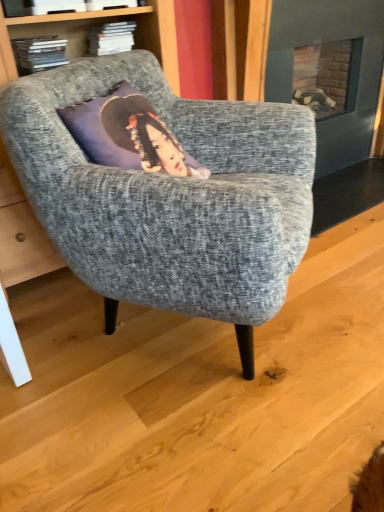
The height and width of the screenshot is (512, 384). What do you see at coordinates (39, 53) in the screenshot?
I see `hardcover book at upper left` at bounding box center [39, 53].

The image size is (384, 512). What are the coordinates of `hardcover book at upper left` in the screenshot? It's located at (39, 53).

What do you see at coordinates (169, 194) in the screenshot? I see `textured gray armchair at center` at bounding box center [169, 194].

Identify the location of textured gray armchair at center. The width and height of the screenshot is (384, 512). coord(169,194).

Where is `hardcover book at upper left`? This screenshot has width=384, height=512. hardcover book at upper left is located at coordinates (39, 53).

In the scene shown: Which object is positioned more to the left, hardcover book at upper left or textured gray armchair at center?

From the viewer's perspective, hardcover book at upper left appears more on the left side.

Considering the relative positions of hardcover book at upper left and textured gray armchair at center in the image provided, is hardcover book at upper left behind textured gray armchair at center?

Yes, the depth of hardcover book at upper left is greater than that of textured gray armchair at center.

Considering the points (28, 70) and (69, 221), which point is behind, point (28, 70) or point (69, 221)?

The point (28, 70) is farther.

From the image's perspective, which one is positioned higher, hardcover book at upper left or textured gray armchair at center?

From the image's view, hardcover book at upper left is above.

From a real-world perspective, between hardcover book at upper left and textured gray armchair at center, who is vertically higher?

hardcover book at upper left is physically above.

Between hardcover book at upper left and textured gray armchair at center, which one has smaller width?

With smaller width is hardcover book at upper left.

Can you confirm if hardcover book at upper left is shorter than textured gray armchair at center?

Indeed, hardcover book at upper left has a lesser height compared to textured gray armchair at center.

Between hardcover book at upper left and textured gray armchair at center, which one has smaller size?

hardcover book at upper left.

Is hardcover book at upper left completely or partially outside of textured gray armchair at center?

hardcover book at upper left lies outside textured gray armchair at center's area.

Is hardcover book at upper left placed right next to textured gray armchair at center?

They are not placed beside each other.

Is hardcover book at upper left aimed at textured gray armchair at center?

No, hardcover book at upper left is not aimed at textured gray armchair at center.

Find the location of a particular element. This screenshot has height=512, width=384. chair on the right side of hardcover book at upper left is located at coordinates (169, 194).

Does textured gray armchair at center appear on the left side of hardcover book at upper left?

In fact, textured gray armchair at center is to the right of hardcover book at upper left.

Which object is closer to the camera taking this photo, textured gray armchair at center or hardcover book at upper left?

textured gray armchair at center is more forward.

Considering the points (44, 184) and (17, 47), which point is behind, point (44, 184) or point (17, 47)?

Point (17, 47)

From the image's perspective, is textured gray armchair at center below hardcover book at upper left?

Yes, from the image's perspective, textured gray armchair at center is beneath hardcover book at upper left.

From a real-world perspective, which object stands above the other?

hardcover book at upper left.

In the scene shown: Between textured gray armchair at center and hardcover book at upper left, which one has larger width?

With larger width is textured gray armchair at center.

Considering the sizes of textured gray armchair at center and hardcover book at upper left in the image, is textured gray armchair at center taller or shorter than hardcover book at upper left?

textured gray armchair at center is taller than hardcover book at upper left.

Considering the relative sizes of textured gray armchair at center and hardcover book at upper left in the image provided, is textured gray armchair at center smaller than hardcover book at upper left?

Incorrect, textured gray armchair at center is not smaller in size than hardcover book at upper left.

Which is correct: textured gray armchair at center is inside hardcover book at upper left, or outside of it?

textured gray armchair at center exists outside the volume of hardcover book at upper left.

Are textured gray armchair at center and hardcover book at upper left located far from each other?

textured gray armchair at center is near hardcover book at upper left, not far away.

Is textured gray armchair at center positioned with its back to hardcover book at upper left?

Absolutely, textured gray armchair at center is directed away from hardcover book at upper left.

How different are the orientations of textured gray armchair at center and hardcover book at upper left in degrees?

35.9 degrees separate the facing orientations of textured gray armchair at center and hardcover book at upper left.

Identify the location of chair in front of the hardcover book at upper left. The image size is (384, 512). (169, 194).

The width and height of the screenshot is (384, 512). I want to click on book that is above the textured gray armchair at center (from the image's perspective), so click(39, 53).

You are a GUI agent. You are given a task and a screenshot of the screen. Output one action in this format:
    pyautogui.click(x=<x>, y=<y>)
    Task: Click on the chair that is under the hardcover book at upper left (from a real-world perspective)
    The image size is (384, 512).
    Given the screenshot: What is the action you would take?
    pyautogui.click(x=169, y=194)